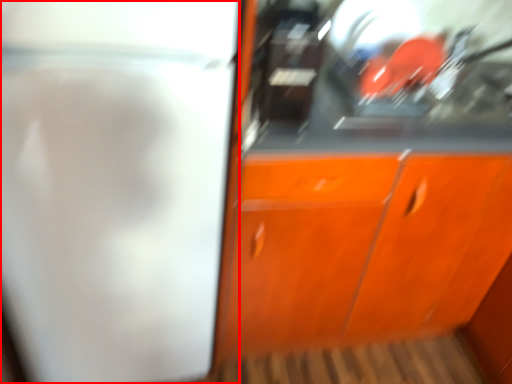
Question: From the image's perspective, considering the relative positions of screen door (annotated by the red box) and cabinetry in the image provided, where is screen door (annotated by the red box) located with respect to the staircase?

Choices:
 (A) below
 (B) above

Answer: (B)